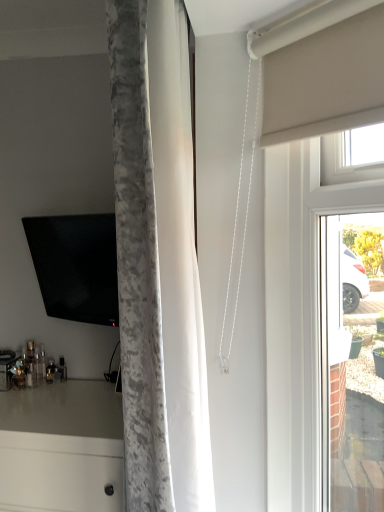
Question: Is white glossy countertop at lower left not inside matte white glass door at right?

Choices:
 (A) no
 (B) yes

Answer: (B)

Question: From a real-world perspective, is white glossy countertop at lower left physically above matte white glass door at right?

Choices:
 (A) yes
 (B) no

Answer: (B)

Question: Considering the relative sizes of white glossy countertop at lower left and matte white glass door at right in the image provided, is white glossy countertop at lower left taller than matte white glass door at right?

Choices:
 (A) yes
 (B) no

Answer: (B)

Question: Could you tell me if white glossy countertop at lower left is facing matte white glass door at right?

Choices:
 (A) yes
 (B) no

Answer: (B)

Question: From a real-world perspective, is white glossy countertop at lower left below matte white glass door at right?

Choices:
 (A) yes
 (B) no

Answer: (A)

Question: From a real-world perspective, is white glossy countertop at lower left positioned above or below matte black tv at left?

Choices:
 (A) below
 (B) above

Answer: (A)

Question: Based on their sizes in the image, would you say white glossy countertop at lower left is bigger or smaller than matte black tv at left?

Choices:
 (A) big
 (B) small

Answer: (A)

Question: From the image's perspective, relative to matte black tv at left, is white glossy countertop at lower left above or below?

Choices:
 (A) below
 (B) above

Answer: (A)

Question: In terms of width, does white glossy countertop at lower left look wider or thinner when compared to matte black tv at left?

Choices:
 (A) thin
 (B) wide

Answer: (B)

Question: Is matte white glass door at right spatially inside matte black tv at left, or outside of it?

Choices:
 (A) outside
 (B) inside

Answer: (A)

Question: Considering the positions of matte white glass door at right and matte black tv at left in the image, is matte white glass door at right wider or thinner than matte black tv at left?

Choices:
 (A) thin
 (B) wide

Answer: (A)

Question: From the image's perspective, is matte white glass door at right positioned above or below matte black tv at left?

Choices:
 (A) below
 (B) above

Answer: (A)

Question: In terms of size, does matte white glass door at right appear bigger or smaller than matte black tv at left?

Choices:
 (A) big
 (B) small

Answer: (A)

Question: Visually, is matte black tv at left positioned to the left or to the right of matte white glass door at right?

Choices:
 (A) right
 (B) left

Answer: (B)

Question: Is matte black tv at left situated inside matte white glass door at right or outside?

Choices:
 (A) outside
 (B) inside

Answer: (A)